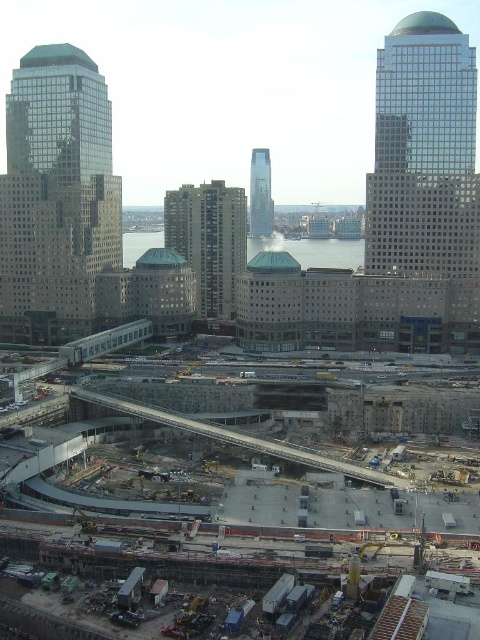
Question: Which point is farther to the camera?

Choices:
 (A) click(x=233, y=500)
 (B) click(x=357, y=467)

Answer: (B)

Question: Is concrete at center wider than gray concrete train track at center?

Choices:
 (A) yes
 (B) no

Answer: (A)

Question: Which point appears closest to the camera in this image?

Choices:
 (A) (189, 429)
 (B) (350, 525)

Answer: (B)

Question: Considering the relative positions of concrete at center and gray concrete train track at center in the image provided, where is concrete at center located with respect to gray concrete train track at center?

Choices:
 (A) below
 (B) above

Answer: (A)

Question: Where is concrete at center located in relation to gray concrete train track at center in the image?

Choices:
 (A) above
 (B) below

Answer: (B)